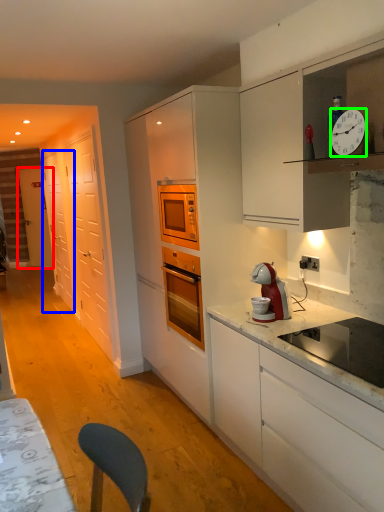
Question: Which is nearer to the door (highlighted by a red box)? glass door (highlighted by a blue box) or clock (highlighted by a green box).

Choices:
 (A) glass door
 (B) clock

Answer: (A)